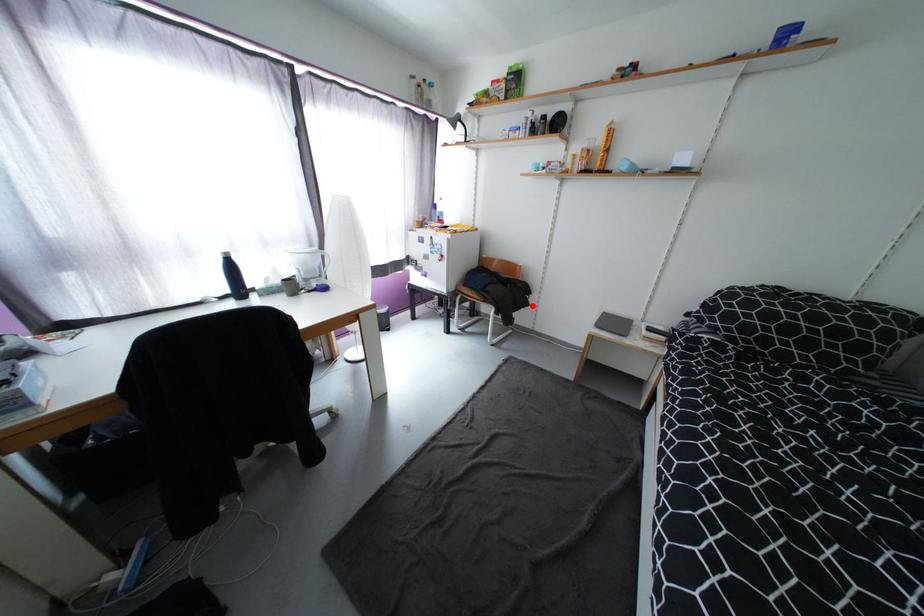
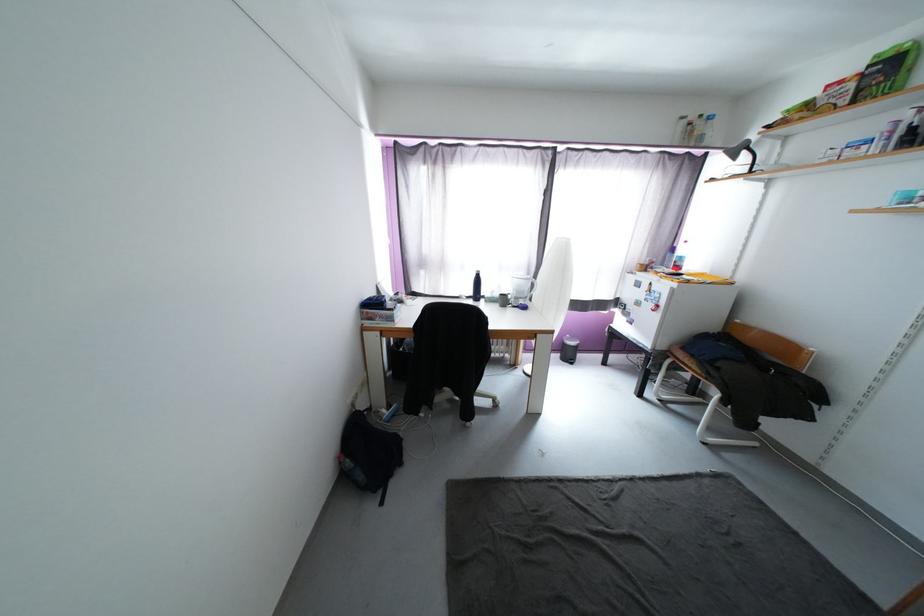
Where in the second image is the point corresponding to the highlighted location from the first image?

(812, 419)